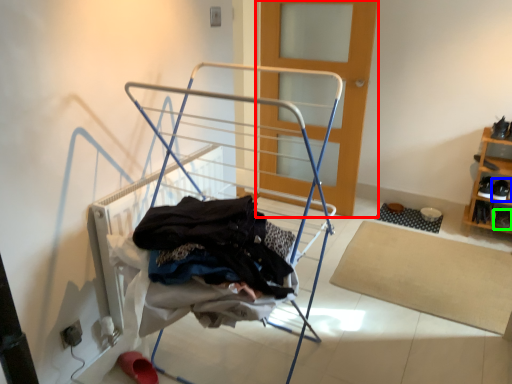
Question: Which object is the farthest from door (highlighted by a red box)? Choose among these: footwear (highlighted by a blue box) or shoe (highlighted by a green box).

Choices:
 (A) footwear
 (B) shoe

Answer: (B)